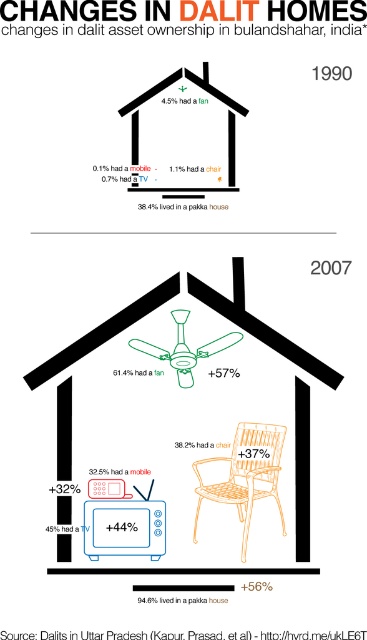
You are an interior designer assessing the layout of the space in the image. Considering the orange woven chair at center and the matte black tv at lower left, which object would require more vertical space due to its height?

The orange woven chair at center requires more vertical space because it has a greater height compared to the matte black tv at lower left.

From the picture: You are an interior designer working on a scale model of a Dalit home from 1990 in Baulandshahar. In your model, the blue plastic tv at lower left and orange woven chair at center are 8.32 inches apart. If the scale is 1 inch equals 1 foot, how far apart are these items in real life?

The blue plastic tv at lower left and orange woven chair at center are 8.32 inches apart on the model. Since the scale is 1 inch equals 1 foot, this means they are 8.32 feet apart in real life.